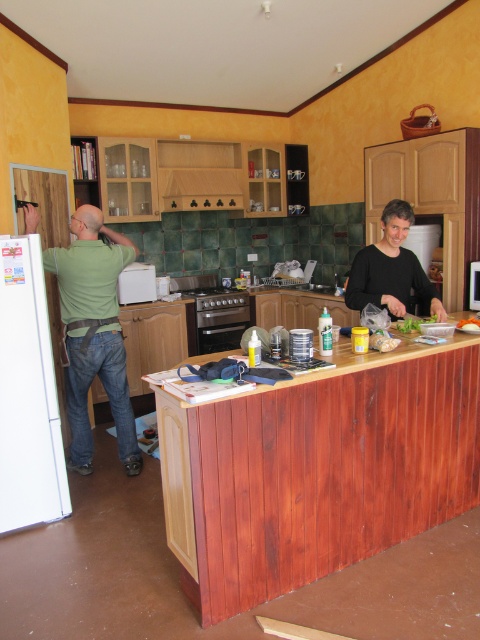
Who is shorter, white matte refrigerator at left or white plastic microwave at center?

With less height is white plastic microwave at center.

Between white matte refrigerator at left and white plastic microwave at center, which one is positioned lower?

white matte refrigerator at left

What do you see at coordinates (27, 394) in the screenshot? I see `white matte refrigerator at left` at bounding box center [27, 394].

Where is `white matte refrigerator at left`? The width and height of the screenshot is (480, 640). white matte refrigerator at left is located at coordinates (27, 394).

Who is positioned more to the right, wooden at center or green leafy salad at center?

Positioned to the right is green leafy salad at center.

Does wooden at center appear under green leafy salad at center?

Yes.

Is point (356, 364) less distant than point (479, 321)?

Yes, point (356, 364) is closer to viewer.

Where is `wooden at center`? wooden at center is located at coordinates (376, 356).

Who is taller, white plastic microwave at center or white glossy microwave at upper center?

white plastic microwave at center

Which is above, white plastic microwave at center or white glossy microwave at upper center?

white plastic microwave at center

Which is behind, point (144, 300) or point (476, 278)?

The point (144, 300) is more distant.

The image size is (480, 640). I want to click on white plastic microwave at center, so click(136, 284).